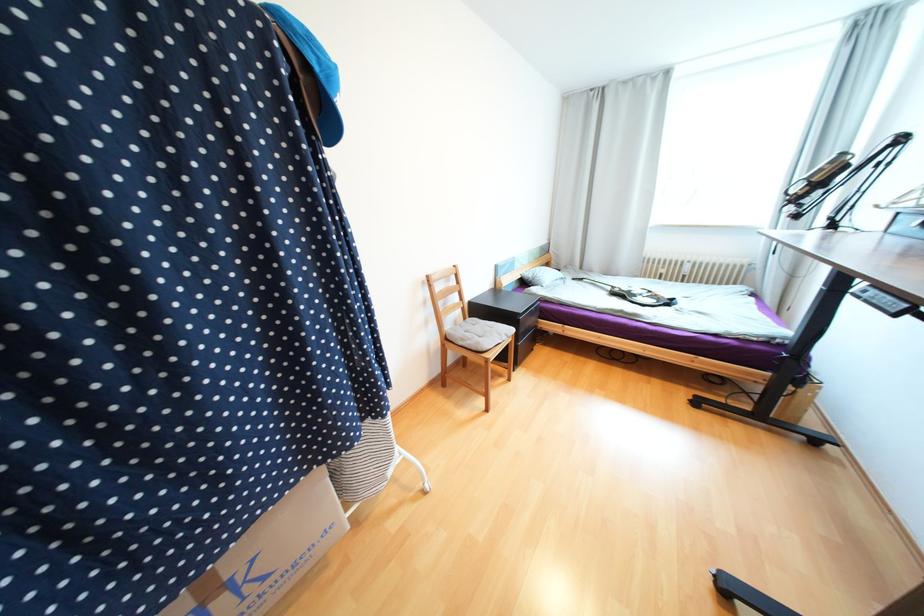
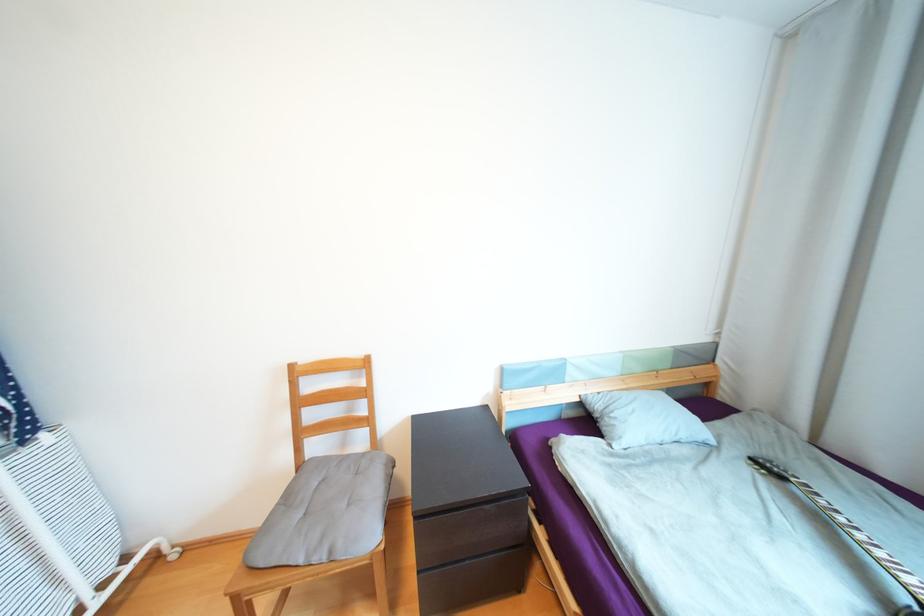
Question: I am providing you with two images of the same scene from different viewpoints. Please identify which objects are invisible in image2.

Choices:
 (A) grey pillow
 (B) patterned guitar strap
 (C) grey chair cushion
 (D) none of these

Answer: (D)